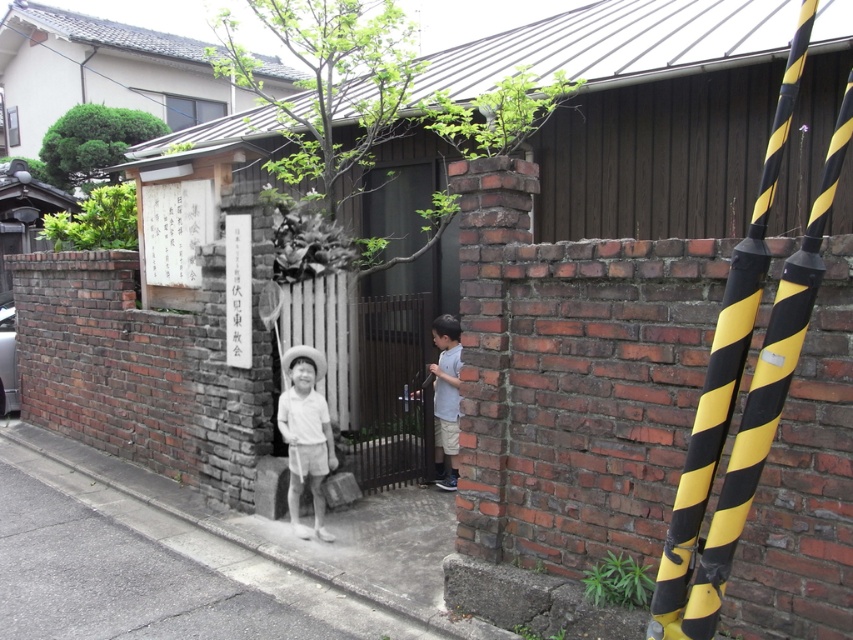
Consider the image. Can you confirm if concrete sidewalk at lower left is positioned to the right of light blue cotton shirt at center?

In fact, concrete sidewalk at lower left is to the left of light blue cotton shirt at center.

Which is above, concrete sidewalk at lower left or light blue cotton shirt at center?

Positioned higher is light blue cotton shirt at center.

The image size is (853, 640). Describe the element at coordinates (225, 552) in the screenshot. I see `concrete sidewalk at lower left` at that location.

At what (x,y) coordinates should I click in order to perform the action: click on concrete sidewalk at lower left. Please return your answer as a coordinate pair (x, y). This screenshot has width=853, height=640. Looking at the image, I should click on (225, 552).

Does dark brown metal gate at center have a lesser height compared to light blue cotton shirt at center?

In fact, dark brown metal gate at center may be taller than light blue cotton shirt at center.

Is point (379, 314) closer to viewer compared to point (447, 428)?

That is True.

What do you see at coordinates (395, 372) in the screenshot? The image size is (853, 640). I see `dark brown metal gate at center` at bounding box center [395, 372].

Where is `dark brown metal gate at center`? The height and width of the screenshot is (640, 853). dark brown metal gate at center is located at coordinates (395, 372).

Is dark brown metal gate at center further to the viewer compared to green leafy tree at upper left?

No, dark brown metal gate at center is in front of green leafy tree at upper left.

Who is more forward, (384, 397) or (119, 122)?

Point (384, 397)

I want to click on dark brown metal gate at center, so click(x=395, y=372).